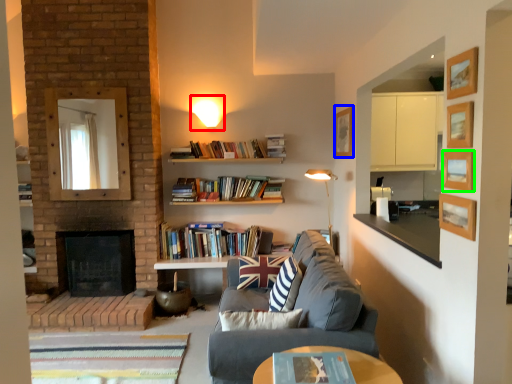
Question: Which is farther away from light fixture (highlighted by a red box)? picture frame (highlighted by a blue box) or picture frame (highlighted by a green box)?

Choices:
 (A) picture frame
 (B) picture frame

Answer: (B)